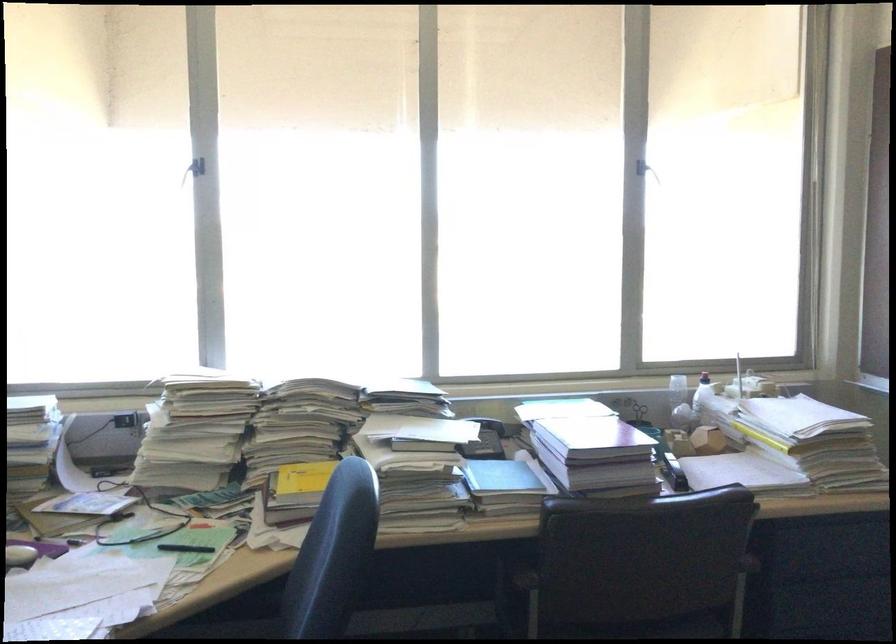
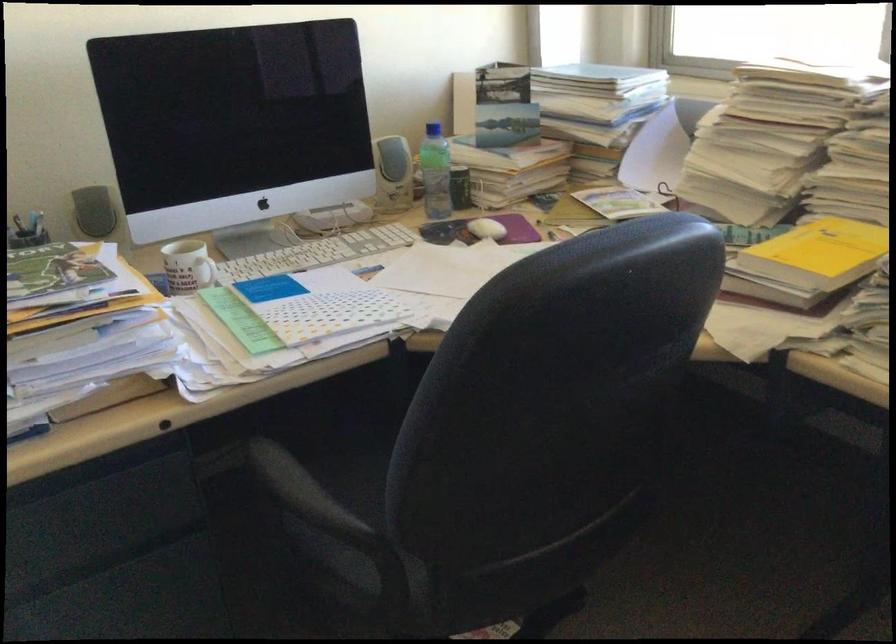
The point at (321,480) is marked in the first image. Where is the corresponding point in the second image?

(819, 252)